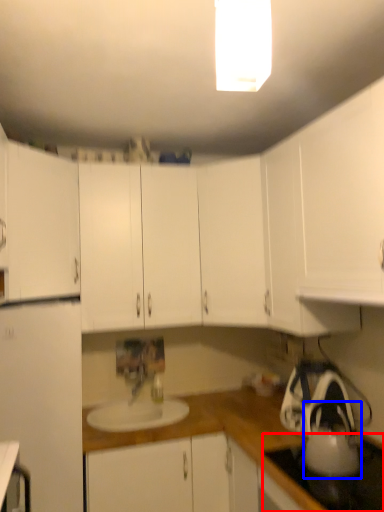
Question: Which object is closer to the camera taking this photo, gas stove (highlighted by a red box) or tea pot (highlighted by a blue box)?

Choices:
 (A) gas stove
 (B) tea pot

Answer: (A)